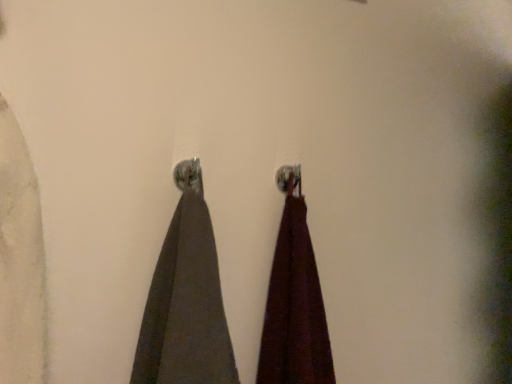
Question: In which direction should I rotate to look at dark gray fabric at center, acting as the second curtain starting from the right?

Choices:
 (A) right
 (B) left

Answer: (B)

Question: From the image's perspective, is burgundy fabric at center, the 1th curtain viewed from the right, located above dark gray fabric at center, acting as the second curtain starting from the right?

Choices:
 (A) no
 (B) yes

Answer: (A)

Question: From a real-world perspective, is burgundy fabric at center, the 1th curtain viewed from the right, on dark gray fabric at center, acting as the second curtain starting from the right?

Choices:
 (A) no
 (B) yes

Answer: (A)

Question: Is burgundy fabric at center, the second curtain in the left-to-right sequence, next to dark gray fabric at center, the first curtain in the left-to-right sequence, and touching it?

Choices:
 (A) yes
 (B) no

Answer: (B)

Question: Does burgundy fabric at center, the 1th curtain viewed from the right, have a greater width compared to dark gray fabric at center, the first curtain in the left-to-right sequence?

Choices:
 (A) yes
 (B) no

Answer: (A)

Question: Does burgundy fabric at center, the 1th curtain viewed from the right, turn towards dark gray fabric at center, acting as the second curtain starting from the right?

Choices:
 (A) no
 (B) yes

Answer: (A)

Question: Considering the relative sizes of burgundy fabric at center, the 1th curtain viewed from the right, and dark gray fabric at center, acting as the second curtain starting from the right, in the image provided, is burgundy fabric at center, the 1th curtain viewed from the right, thinner than dark gray fabric at center, acting as the second curtain starting from the right,?

Choices:
 (A) no
 (B) yes

Answer: (A)

Question: From the image's perspective, is dark gray fabric at center, acting as the second curtain starting from the right, below burgundy fabric at center, the second curtain in the left-to-right sequence?

Choices:
 (A) no
 (B) yes

Answer: (A)

Question: Is dark gray fabric at center, the first curtain in the left-to-right sequence, oriented towards burgundy fabric at center, the 1th curtain viewed from the right?

Choices:
 (A) yes
 (B) no

Answer: (B)

Question: Considering the relative sizes of dark gray fabric at center, acting as the second curtain starting from the right, and burgundy fabric at center, the second curtain in the left-to-right sequence, in the image provided, is dark gray fabric at center, acting as the second curtain starting from the right, shorter than burgundy fabric at center, the second curtain in the left-to-right sequence,?

Choices:
 (A) yes
 (B) no

Answer: (A)

Question: Is dark gray fabric at center, the first curtain in the left-to-right sequence, not near burgundy fabric at center, the 1th curtain viewed from the right?

Choices:
 (A) no
 (B) yes

Answer: (A)

Question: Considering the relative sizes of dark gray fabric at center, the first curtain in the left-to-right sequence, and burgundy fabric at center, the 1th curtain viewed from the right, in the image provided, is dark gray fabric at center, the first curtain in the left-to-right sequence, wider than burgundy fabric at center, the 1th curtain viewed from the right,?

Choices:
 (A) no
 (B) yes

Answer: (A)

Question: Is dark gray fabric at center, acting as the second curtain starting from the right, looking in the opposite direction of burgundy fabric at center, the second curtain in the left-to-right sequence?

Choices:
 (A) no
 (B) yes

Answer: (A)

Question: From the image's perspective, is dark gray fabric at center, the first curtain in the left-to-right sequence, above or below burgundy fabric at center, the second curtain in the left-to-right sequence?

Choices:
 (A) above
 (B) below

Answer: (A)